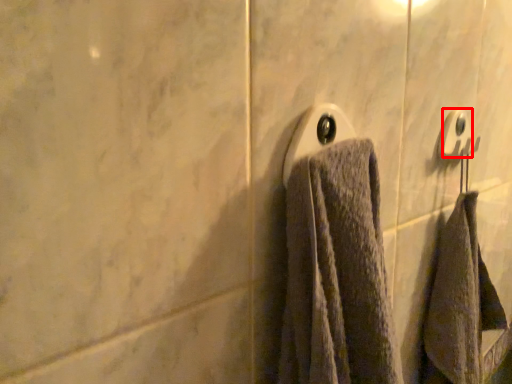
Question: Observing the image, what is the correct spatial positioning of towel bar (annotated by the red box) in reference to towel bar?

Choices:
 (A) right
 (B) left

Answer: (A)